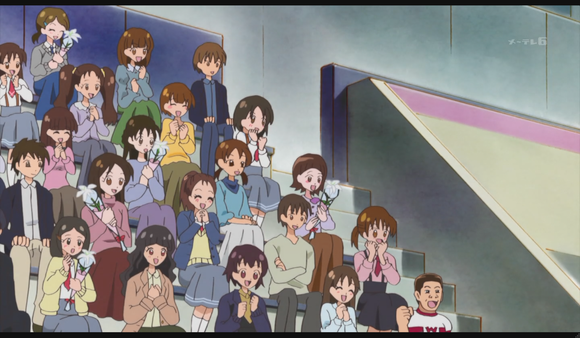
The height and width of the screenshot is (338, 580). I want to click on wall, so click(463, 48).